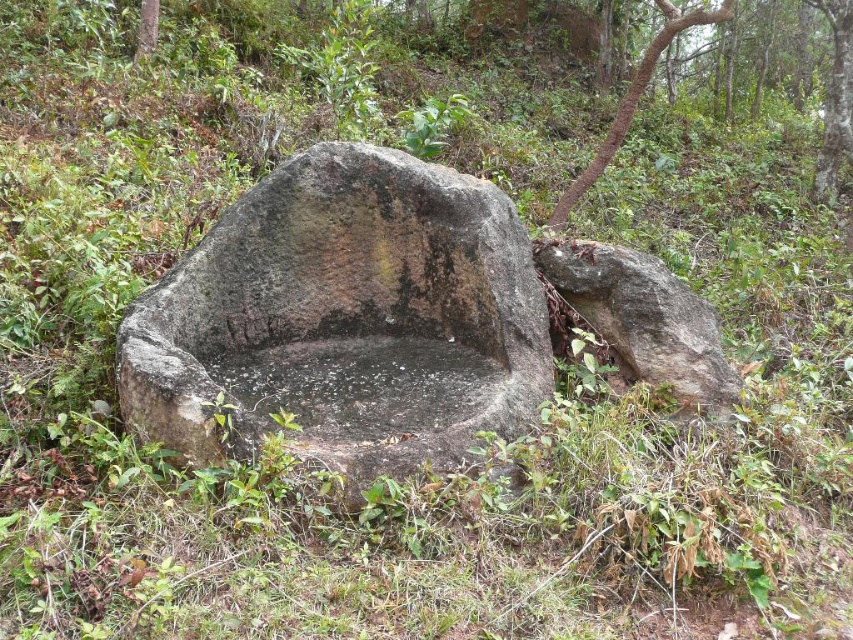
Does gray rough stone at center have a lesser width compared to gray rough boulder at right?

No, gray rough stone at center is not thinner than gray rough boulder at right.

Who is more forward, (439, 266) or (662, 376)?

Point (662, 376)

Locate an element on the screen. gray rough stone at center is located at coordinates (345, 320).

Is gray rough stone at center positioned before brown rough bark tree at upper center?

That is True.

Is gray rough stone at center thinner than brown rough bark tree at upper center?

No.

The height and width of the screenshot is (640, 853). What do you see at coordinates (345, 320) in the screenshot? I see `gray rough stone at center` at bounding box center [345, 320].

Where is `gray rough stone at center`? The image size is (853, 640). gray rough stone at center is located at coordinates (345, 320).

Looking at this image, is gray rough boulder at right behind brown rough bark tree at upper center?

No.

Can you confirm if gray rough boulder at right is positioned to the left of brown rough bark tree at upper center?

Correct, you'll find gray rough boulder at right to the left of brown rough bark tree at upper center.

In order to click on gray rough boulder at right in this screenshot , I will do `click(643, 321)`.